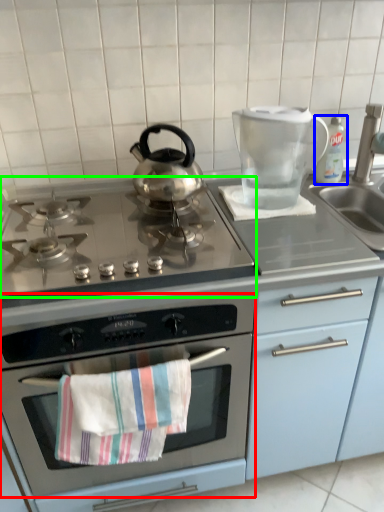
Question: Which is nearer to the oven (highlighted by a red box)? bottle (highlighted by a blue box) or gas stove (highlighted by a green box).

Choices:
 (A) bottle
 (B) gas stove

Answer: (B)